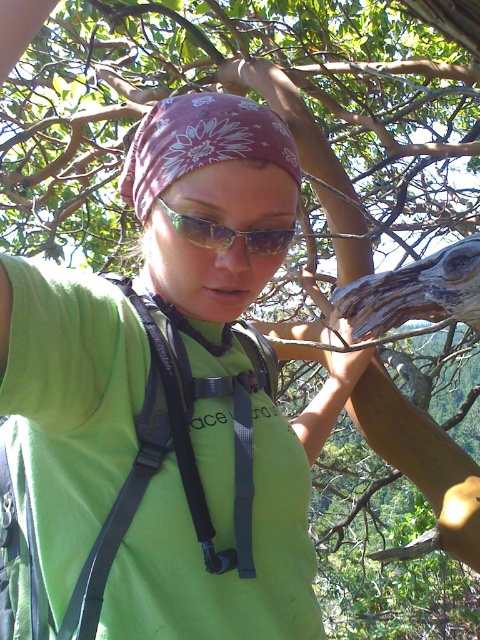
You are a photographer trying to capture a detailed shot of two specific points in the scene. The first point is at coordinates point (84, 628) and the second is at point (266, 253). Which point should you focus on first if you want to ensure both are in sharp focus without adjusting the camera focus?

You should focus on point (84, 628) first because it is closer to the camera than point (266, 253). By focusing on the closer point, the farther point will still be within the depth of field, ensuring both are in sharp focus without needing to adjust the camera focus.

You are a photographer trying to capture the hiker in the image. The black fabric strap at center is represented by point (177,456). Where should you position your camera to ensure the black fabric strap at center is in the center of your photo?

To center the black fabric strap at center, position your camera so that the point (177,456) is at the center of the frame.

You are trying to decide which item to adjust first while hiking. The black fabric strap at center and the purple floral bandana at center are both visible. Which item is bigger and might need more adjustment?

The black fabric strap at center is larger in size than the purple floral bandana at center, so it might need more adjustment.